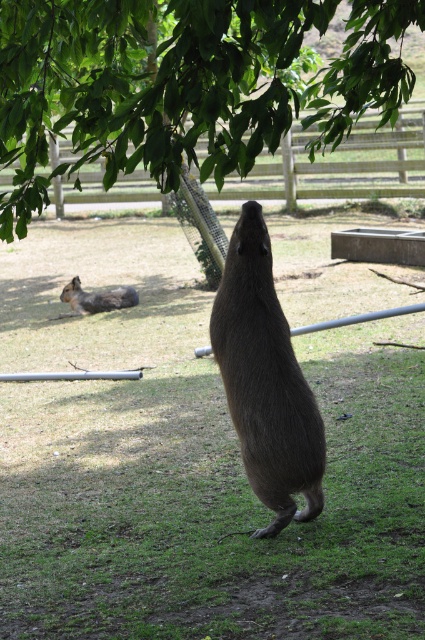
Question: Observing the image, what is the correct spatial positioning of green leafy tree at upper center in reference to wooden fence at upper center?

Choices:
 (A) right
 (B) left

Answer: (B)

Question: Which of the following is the closest to the observer?

Choices:
 (A) (209, 182)
 (B) (113, 305)

Answer: (B)

Question: Is wooden fence at upper center wider than brown furry rodent at lower left?

Choices:
 (A) no
 (B) yes

Answer: (B)

Question: Is green leafy tree at upper center below wooden fence at upper center?

Choices:
 (A) no
 (B) yes

Answer: (A)

Question: Which of the following is the farthest from the observer?

Choices:
 (A) brown furry rodent at lower left
 (B) wooden fence at upper center
 (C) green leafy tree at upper center

Answer: (B)

Question: Which point appears farthest from the camera in this image?

Choices:
 (A) (99, 186)
 (B) (282, 445)
 (C) (81, 90)
 (D) (84, 292)

Answer: (A)